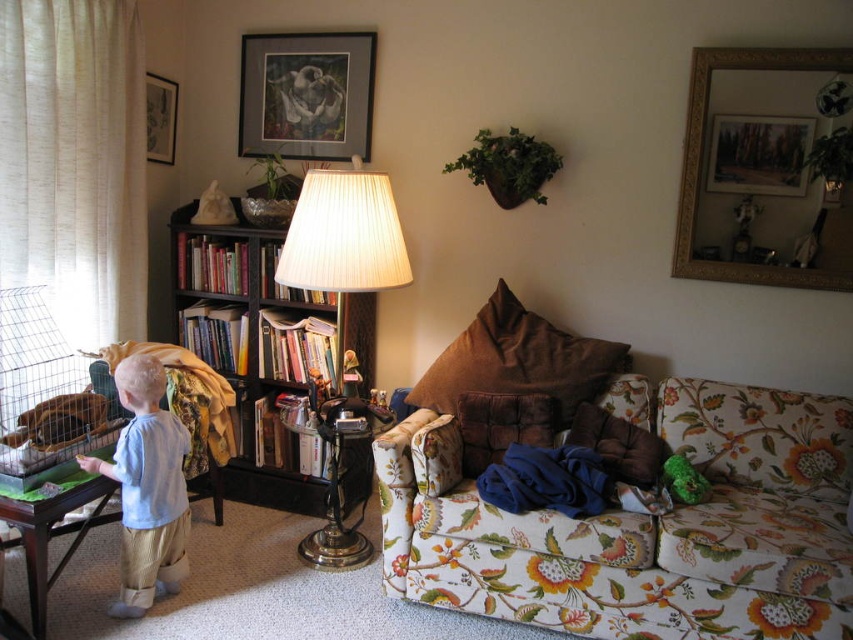
Is point (271, 237) closer to viewer compared to point (152, 451)?

No, it is behind (152, 451).

Is point (241, 401) positioned after point (157, 570)?

That is True.

Is point (239, 236) less distant than point (144, 403)?

No.

I want to click on black wood bookcase at left, so click(247, 348).

Who is more distant from viewer, (552,326) or (154,100)?

The point (154,100) is behind.

Is floral fabric couch at center in front of matte black picture frame at upper left?

Yes.

At what (x,y) coordinates should I click in order to perform the action: click on floral fabric couch at center. Please return your answer as a coordinate pair (x, y). Looking at the image, I should click on (618, 508).

Which of these two, floral fabric couch at center or wooden framed picture at upper center, stands taller?

With more height is floral fabric couch at center.

Where is `floral fabric couch at center`? floral fabric couch at center is located at coordinates (618, 508).